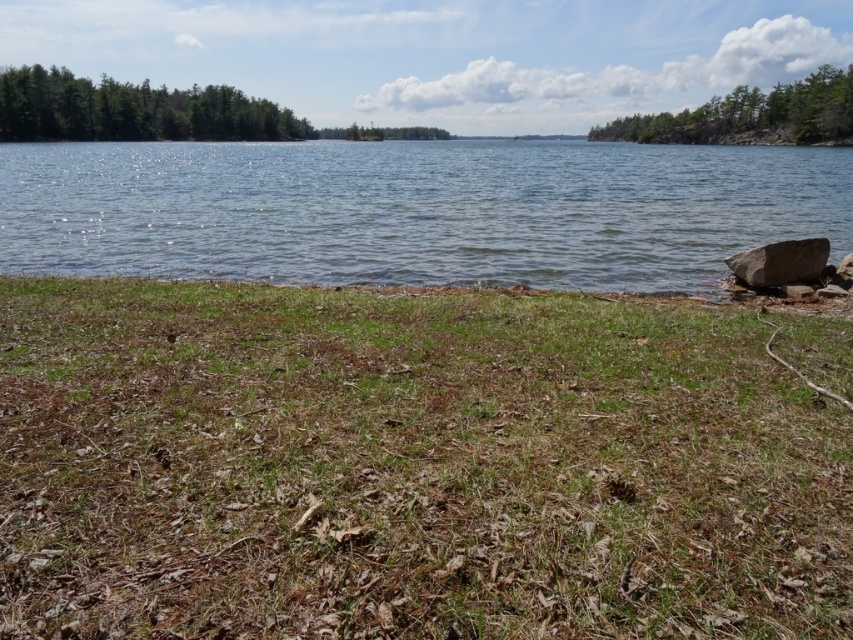
Is clear water at center in front of green leafy trees at upper right?

That is True.

Find the location of a particular element. clear water at center is located at coordinates (415, 211).

Is green dry grass at lower center positioned before green leafy trees at left?

Yes, green dry grass at lower center is in front of green leafy trees at left.

Based on the photo, can you confirm if green dry grass at lower center is positioned to the right of green leafy trees at left?

Yes, green dry grass at lower center is to the right of green leafy trees at left.

Is point (294, 314) positioned in front of point (303, 125)?

Yes.

Find the location of `green dry grass at lower center`. green dry grass at lower center is located at coordinates (416, 465).

Does point (86, 298) lie in front of point (759, 275)?

That is True.

Is green dry grass at lower center wider than gray smooth rock at right?

No.

The height and width of the screenshot is (640, 853). What do you see at coordinates (416, 465) in the screenshot?
I see `green dry grass at lower center` at bounding box center [416, 465].

The width and height of the screenshot is (853, 640). Find the location of `green dry grass at lower center`. green dry grass at lower center is located at coordinates (416, 465).